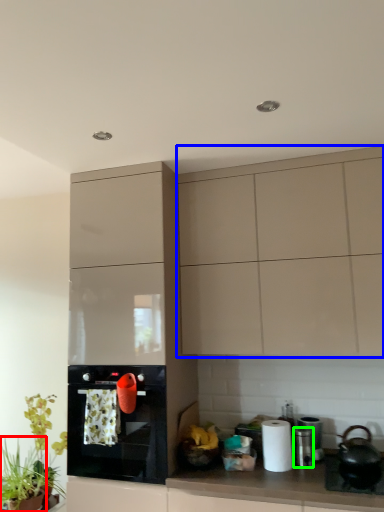
Question: Which is farther away from plant (highlighted by a red box)? cabinetry (highlighted by a blue box) or appliance (highlighted by a green box)?

Choices:
 (A) cabinetry
 (B) appliance

Answer: (A)